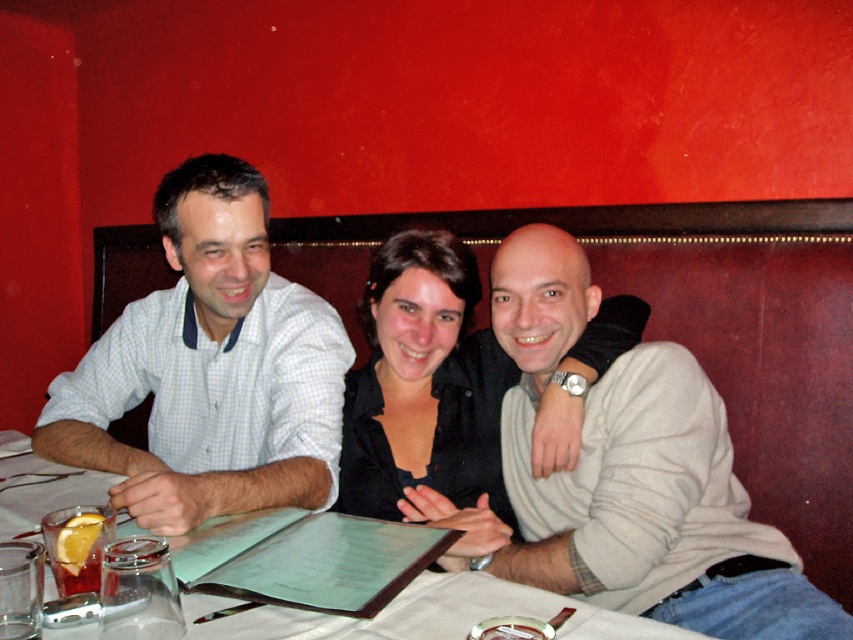
You are a photographer standing at the entrance of the restaurant. You need to take a photo of the light gray sweater at center. Where should you position yourself to capture it in the frame?

To capture the light gray sweater at center in the frame, position yourself directly facing the center of the booth where the sweater is located, as it is positioned at coordinates point (627,476).

You are a photographer standing in front of the booth. You want to take a photo of the light gray sweater at center and the white checkered shirt at left. Which one will appear larger in the photo?

The light gray sweater at center will appear larger in the photo because it is closer to the viewer than the white checkered shirt at left.

You are a waiter trying to deliver a drink to the table. The light gray sweater at center and the white paper menu at center are on the table. Which item is closer to you as you approach the table from the front?

The light gray sweater at center is closer to you because the white paper menu at center is behind it.